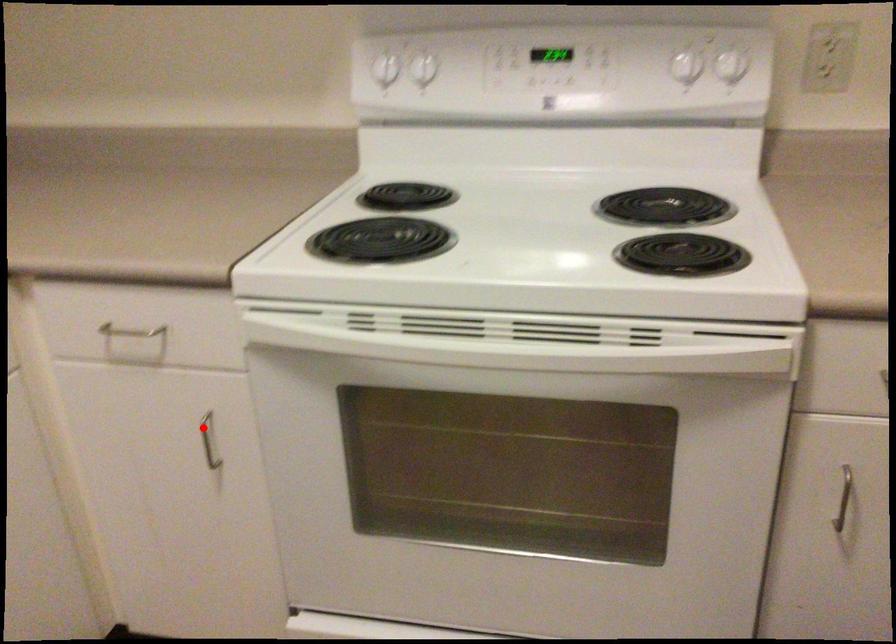
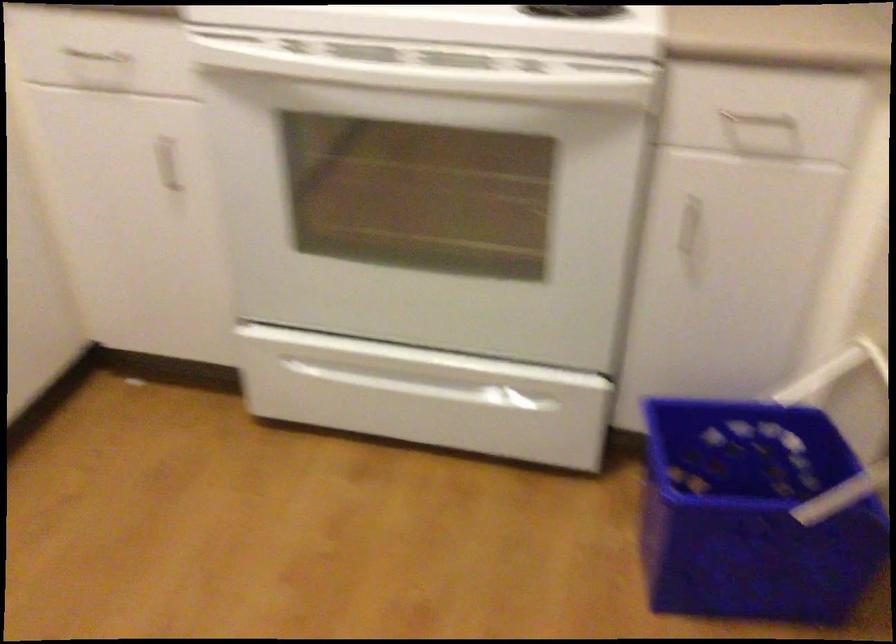
Question: I am providing you with two images of the same scene from different viewpoints. Image1 has a red point marked. In image2, the corresponding 3D location appears at what relative position? Reply with the corresponding letter.

Choices:
 (A) Closer
 (B) Farther

Answer: (B)